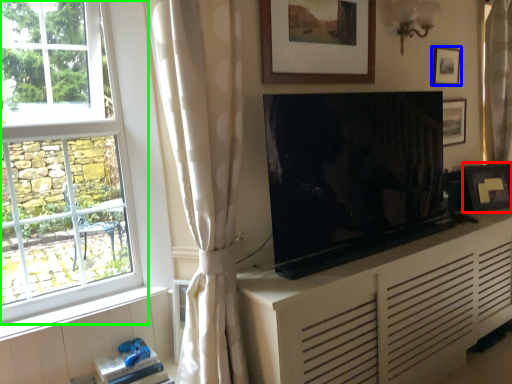
Question: Considering the real-world distances, which object is closest to picture frame (highlighted by a red box)? picture frame (highlighted by a blue box) or window (highlighted by a green box).

Choices:
 (A) picture frame
 (B) window

Answer: (A)